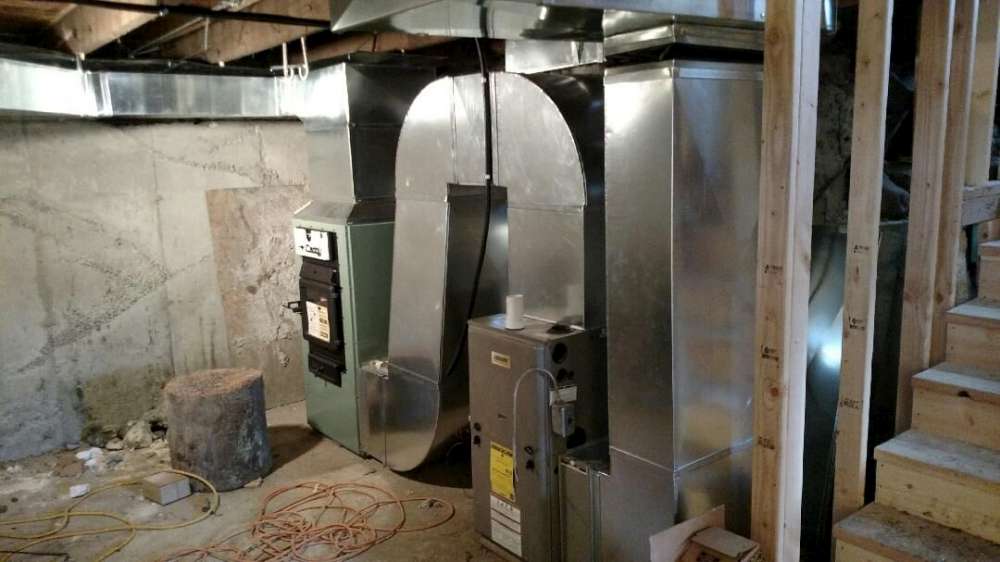
This screenshot has width=1000, height=562. In order to click on concrete floor in this screenshot , I will do `click(177, 539)`.